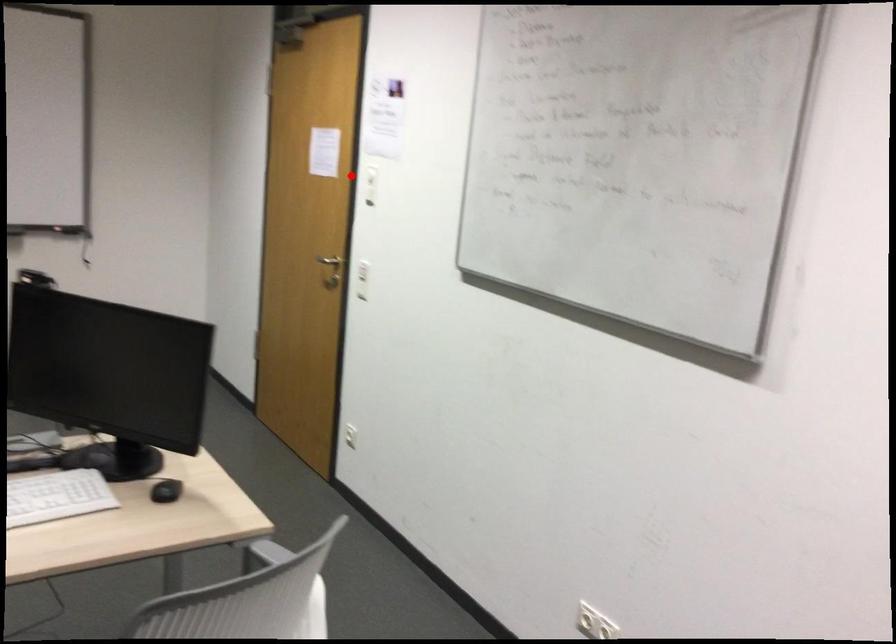
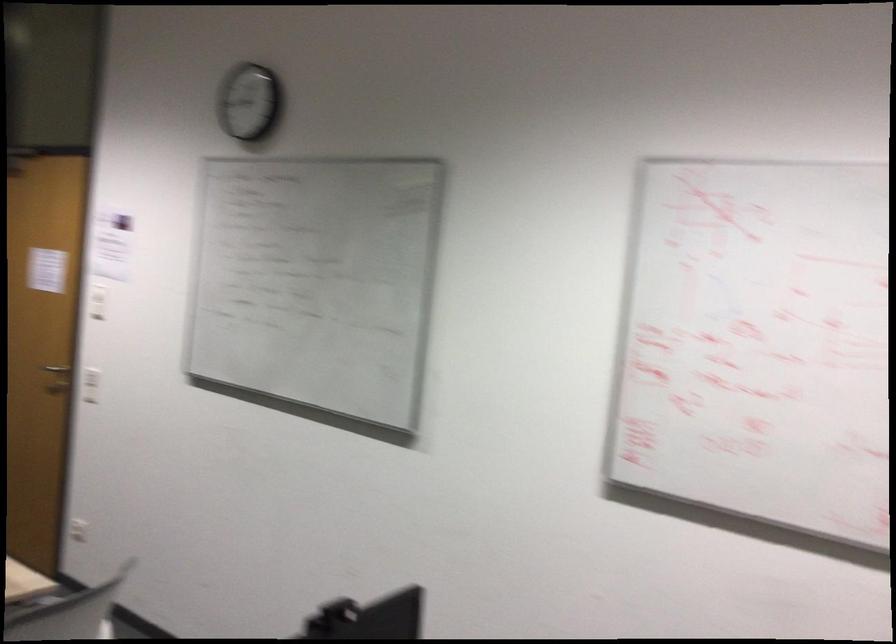
Locate, in the second image, the point that corresponds to the highlighted location in the first image.

(97, 301)